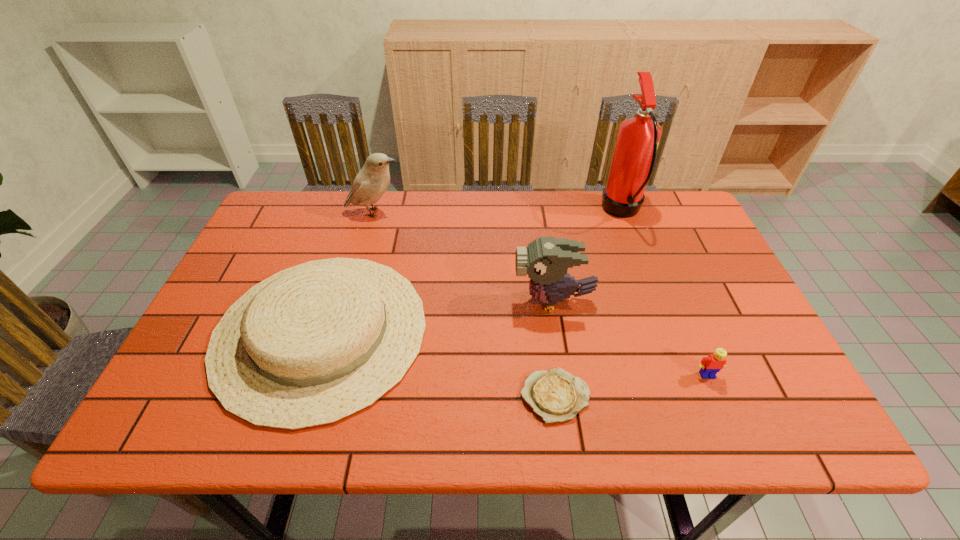
You are a GUI agent. You are given a task and a screenshot of the screen. Output one action in this format:
    pyautogui.click(x=<x>, y=<y>)
    Task: Click on the free spot between the Lego and the nearer bird
    The width and height of the screenshot is (960, 540).
    Given the screenshot: What is the action you would take?
    pyautogui.click(x=630, y=338)

Locate an element on the screen. The width and height of the screenshot is (960, 540). blank region between the right bird and the sunhat is located at coordinates (437, 316).

The width and height of the screenshot is (960, 540). Identify the location of free space between the Lego and the sunhat. (514, 353).

You are a GUI agent. You are given a task and a screenshot of the screen. Output one action in this format:
    pyautogui.click(x=<x>, y=<y>)
    Task: Click on the free spot between the quiche and the tallest object
    This screenshot has width=960, height=540.
    Given the screenshot: What is the action you would take?
    pyautogui.click(x=588, y=304)

I want to click on vacant space that is in between the shortest object and the sunhat, so click(438, 364).

In order to click on free space between the shortest object and the right bird in this screenshot , I will do `click(554, 348)`.

The height and width of the screenshot is (540, 960). I want to click on free space between the Lego and the right bird, so click(x=630, y=338).

The image size is (960, 540). I want to click on vacant space in between the sunhat and the nearer bird, so click(437, 316).

Locate an element on the screen. Image resolution: width=960 pixels, height=540 pixels. free space between the shortest object and the sunhat is located at coordinates (438, 364).

Select which object appears as the fifth closest to the left bird. Please provide its 2D coordinates. Your answer should be formatted as a tuple, i.e. [(x, y)], where the tuple contains the x and y coordinates of a point satisfying the conditions above.

[(710, 365)]